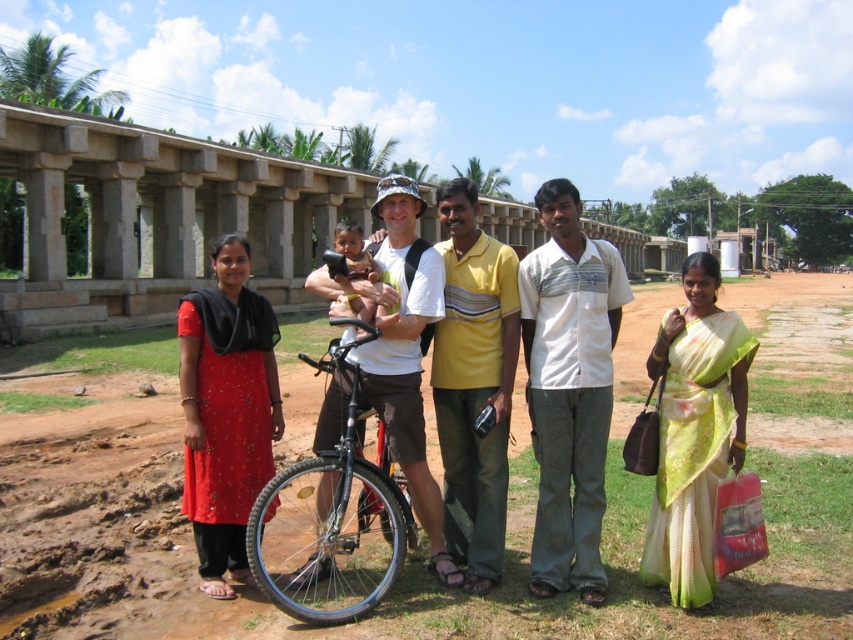
Consider the image. Between yellow striped shirt at center and black matte bicycle at center, which one appears on the right side from the viewer's perspective?

From the viewer's perspective, yellow striped shirt at center appears more on the right side.

Which is in front, point (440, 337) or point (366, 556)?

Positioned in front is point (440, 337).

Locate an element on the screen. The image size is (853, 640). yellow striped shirt at center is located at coordinates (474, 381).

Who is shorter, white striped shirt at center or black matte bicycle at center?

black matte bicycle at center is shorter.

Between point (579, 556) and point (396, 518), which one is positioned in front?

Point (396, 518) is in front.

Is point (592, 474) farther from viewer compared to point (294, 524)?

No, it is not.

Find the location of `white striped shirt at center`. white striped shirt at center is located at coordinates (569, 388).

This screenshot has width=853, height=640. Describe the element at coordinates (432, 356) in the screenshot. I see `matte white bicycle at center` at that location.

Image resolution: width=853 pixels, height=640 pixels. Find the location of `matte white bicycle at center`. matte white bicycle at center is located at coordinates (432, 356).

This screenshot has height=640, width=853. What do you see at coordinates (432, 356) in the screenshot?
I see `matte white bicycle at center` at bounding box center [432, 356].

Where is `matte white bicycle at center`? The image size is (853, 640). matte white bicycle at center is located at coordinates (432, 356).